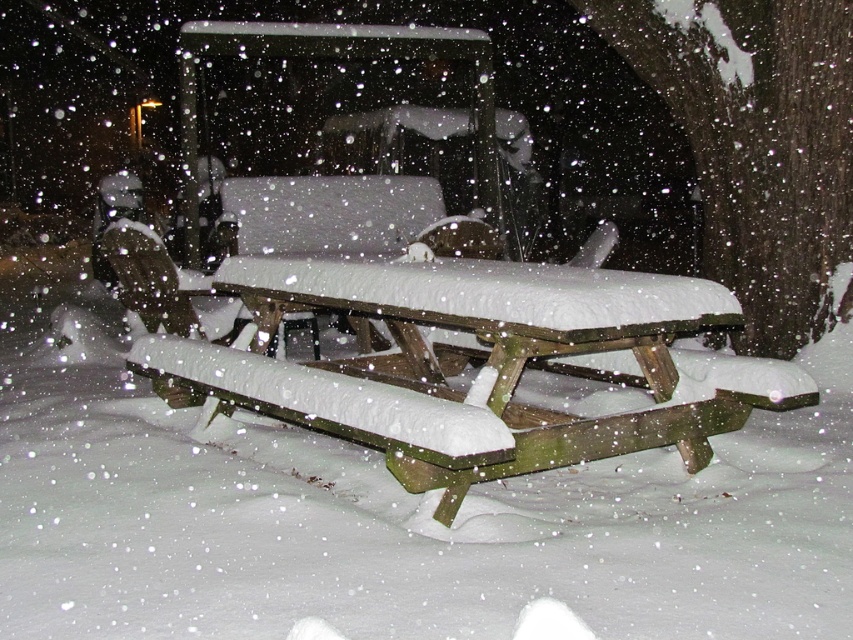
Question: Is wooden picnic table at center to the right of snow-covered wood park bench at center from the viewer's perspective?

Choices:
 (A) no
 (B) yes

Answer: (B)

Question: Can you confirm if wooden picnic table at center is positioned to the right of snow-covered wood park bench at center?

Choices:
 (A) no
 (B) yes

Answer: (B)

Question: Which of the following is the closest to the observer?

Choices:
 (A) (401, 310)
 (B) (268, 241)

Answer: (A)

Question: Which of the following is the farthest from the observer?

Choices:
 (A) (306, 237)
 (B) (288, 301)

Answer: (A)

Question: Is wooden picnic table at center positioned behind snow-covered wood park bench at center?

Choices:
 (A) yes
 (B) no

Answer: (B)